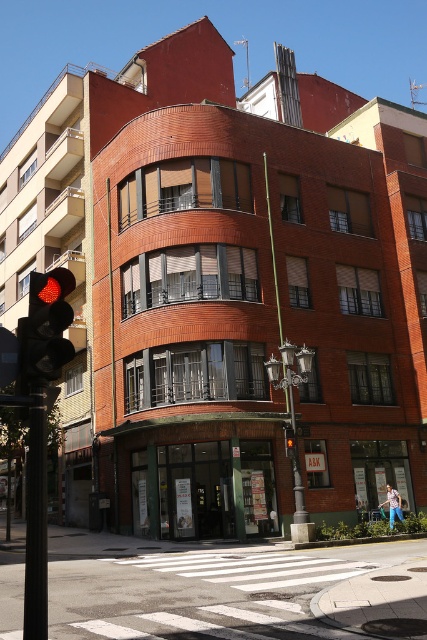
You are standing in front of the building and notice a black metal pole at left and a green metal streetlight at center. Which object is closer to the entrance of the building?

The green metal streetlight at center is closer to the entrance of the building because it is positioned to the right of the black metal pole at left, which is further away.

You are standing at the entrance of the commercial establishment with the sign A and K. You want to find the black metal pole at left. In which direction should you look to find it?

The black metal pole at left is located at point (35, 518), which is to the left side of the entrance. Therefore, you should look to your left to find the black metal pole at left.